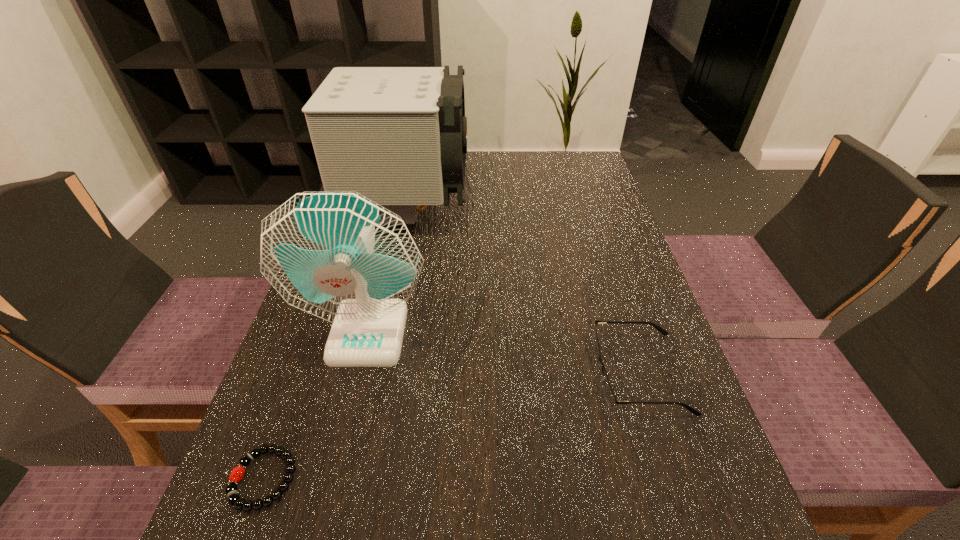
Identify the location of free location located on the front-facing side of the third tallest object. (468, 373).

Locate an element on the screen. The width and height of the screenshot is (960, 540). vacant space located on the back of the bracelet is located at coordinates pyautogui.click(x=314, y=339).

Identify the location of object located at the far edge. (397, 135).

Where is `bracelet that is at the left edge`? bracelet that is at the left edge is located at coordinates (237, 473).

Where is `object at the right edge`? The height and width of the screenshot is (540, 960). object at the right edge is located at coordinates (610, 397).

At what (x,y) coordinates should I click in order to perform the action: click on object present at the far left corner. Please return your answer as a coordinate pair (x, y). The image size is (960, 540). Looking at the image, I should click on (397, 135).

You are a GUI agent. You are given a task and a screenshot of the screen. Output one action in this format:
    pyautogui.click(x=<x>, y=<y>)
    Task: Click on the vacant area at the far edge of the desktop
    This screenshot has width=960, height=540.
    Given the screenshot: What is the action you would take?
    pyautogui.click(x=467, y=176)

The width and height of the screenshot is (960, 540). Find the location of `free space at the left edge of the desktop`. free space at the left edge of the desktop is located at coordinates (337, 492).

I want to click on free location at the right edge of the desktop, so click(x=583, y=247).

Locate an element on the screen. This screenshot has height=540, width=960. vacant area that lies between the nearest object and the second shortest object is located at coordinates (451, 426).